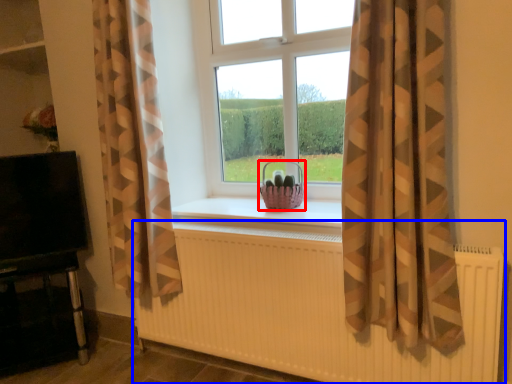
Question: Which of the following is the farthest to the observer, basket (highlighted by a red box) or radiator (highlighted by a blue box)?

Choices:
 (A) basket
 (B) radiator

Answer: (A)